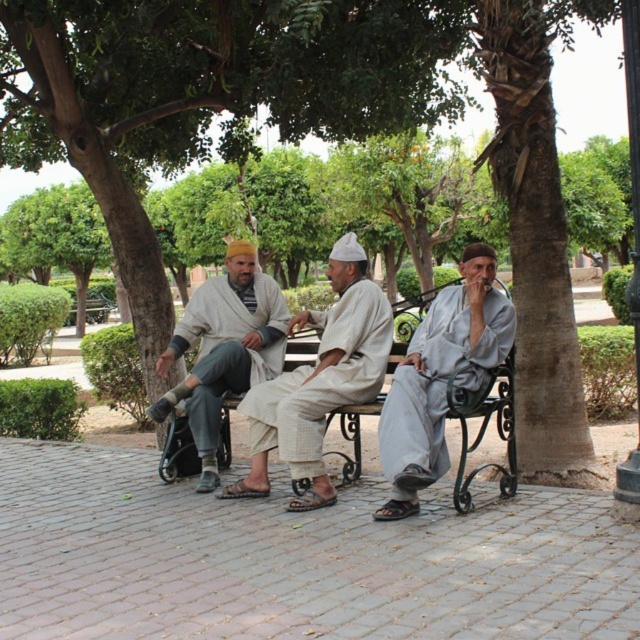
Can you confirm if green leafy tree at center is taller than matte gray robe at center?

In fact, green leafy tree at center may be shorter than matte gray robe at center.

Does green leafy tree at center come behind matte gray robe at center?

Yes, green leafy tree at center is behind matte gray robe at center.

Locate an element on the screen. green leafy tree at center is located at coordinates (211, 92).

Based on the photo, how distant is light beige fabric robe at center from matte gray robe at center?

They are 29.45 inches apart.

Can you confirm if light beige fabric robe at center is positioned above matte gray robe at center?

Actually, light beige fabric robe at center is below matte gray robe at center.

What do you see at coordinates (320, 381) in the screenshot?
I see `light beige fabric robe at center` at bounding box center [320, 381].

Image resolution: width=640 pixels, height=640 pixels. I want to click on light beige fabric robe at center, so click(x=320, y=381).

In the scene shown: Does green leafy tree at center appear over light beige fabric robe at center?

Indeed, green leafy tree at center is positioned over light beige fabric robe at center.

Can you confirm if green leafy tree at center is positioned below light beige fabric robe at center?

Incorrect, green leafy tree at center is not positioned below light beige fabric robe at center.

Is point (125, 44) closer to camera compared to point (378, 344)?

No.

The height and width of the screenshot is (640, 640). Identify the location of green leafy tree at center. (211, 92).